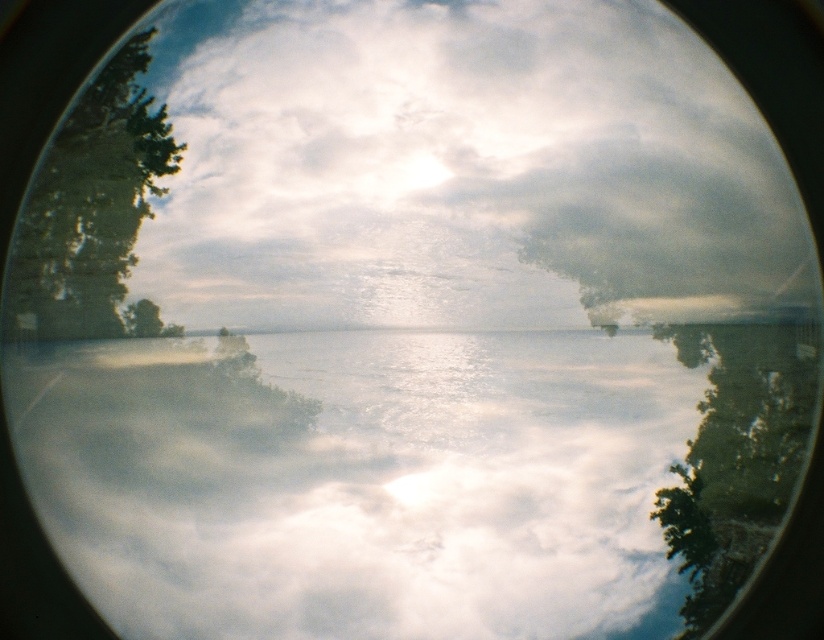
Does point (250, 362) come farther from viewer compared to point (136, 70)?

Yes, it is.

You are a GUI agent. You are given a task and a screenshot of the screen. Output one action in this format:
    pyautogui.click(x=<x>, y=<y>)
    Task: Click on the translucent glass water at center
    
    Given the screenshot: What is the action you would take?
    pyautogui.click(x=413, y=477)

Is cloudy sky at upper center further to the viewer compared to green leafy tree at left?

Yes, it is.

Can you confirm if cloudy sky at upper center is thinner than green leafy tree at left?

No, cloudy sky at upper center is not thinner than green leafy tree at left.

Which is behind, point (487, 196) or point (133, 96)?

The point (487, 196) is more distant.

Where is `cloudy sky at upper center`? cloudy sky at upper center is located at coordinates (459, 168).

Can you confirm if translucent glass water at center is positioned to the left of cloudy sky at upper center?

Yes, translucent glass water at center is to the left of cloudy sky at upper center.

Between translucent glass water at center and cloudy sky at upper center, which one appears on the right side from the viewer's perspective?

Positioned to the right is cloudy sky at upper center.

Between point (696, 458) and point (195, 124), which one is positioned behind?

The point (195, 124) is more distant.

Identify the location of translucent glass water at center. (413, 477).